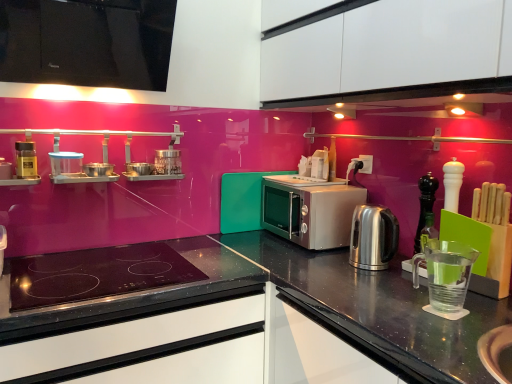
Question: From the image's perspective, is transparent plastic measuring cup at right, which is counted as the 4th appliance, starting from the top, over satin silver microwave at center?

Choices:
 (A) yes
 (B) no

Answer: (B)

Question: Is transparent plastic measuring cup at right, which is counted as the 4th appliance, starting from the top, to the right of satin silver microwave at center from the viewer's perspective?

Choices:
 (A) yes
 (B) no

Answer: (A)

Question: Can you confirm if transparent plastic measuring cup at right, which is the first appliance from bottom to top, is smaller than satin silver microwave at center?

Choices:
 (A) yes
 (B) no

Answer: (A)

Question: Does transparent plastic measuring cup at right, which is the first appliance from bottom to top, have a larger size compared to satin silver microwave at center?

Choices:
 (A) no
 (B) yes

Answer: (A)

Question: Can you confirm if transparent plastic measuring cup at right, positioned as the fourth appliance in left-to-right order, is taller than satin silver microwave at center?

Choices:
 (A) yes
 (B) no

Answer: (B)

Question: Would you say clear plastic container at upper left, arranged as the third appliance when ordered from the bottom, is inside or outside white matte cabinet at upper center, the 2th cabinetry in the left-to-right sequence?

Choices:
 (A) outside
 (B) inside

Answer: (A)

Question: Is clear plastic container at upper left, acting as the second appliance starting from the top, in front of or behind white matte cabinet at upper center, the 2th cabinetry in the left-to-right sequence, in the image?

Choices:
 (A) behind
 (B) front

Answer: (A)

Question: Is point (65, 165) positioned closer to the camera than point (423, 14)?

Choices:
 (A) closer
 (B) farther

Answer: (B)

Question: From a real-world perspective, relative to white matte cabinet at upper center, the 2th cabinetry in the left-to-right sequence, is clear plastic container at upper left, acting as the second appliance starting from the top, vertically above or below?

Choices:
 (A) above
 (B) below

Answer: (B)

Question: Is transparent plastic measuring cup at right, which is the first appliance from bottom to top, inside or outside of black glass cooktop at center?

Choices:
 (A) inside
 (B) outside

Answer: (B)

Question: From a real-world perspective, is transparent plastic measuring cup at right, which is the first appliance from bottom to top, above or below black glass cooktop at center?

Choices:
 (A) below
 (B) above

Answer: (A)

Question: Considering their positions, is transparent plastic measuring cup at right, the first appliance from the right, located in front of or behind black glass cooktop at center?

Choices:
 (A) front
 (B) behind

Answer: (B)

Question: Is transparent plastic measuring cup at right, the first appliance from the right, wider or thinner than black glass cooktop at center?

Choices:
 (A) wide
 (B) thin

Answer: (B)

Question: In the image, is black matte drawer at lower left on the left side or the right side of white matte cabinet at upper center, the 2th cabinetry in the left-to-right sequence?

Choices:
 (A) left
 (B) right

Answer: (A)

Question: From the image's perspective, is black matte drawer at lower left located above or below white matte cabinet at upper center, the first cabinetry from the right?

Choices:
 (A) below
 (B) above

Answer: (A)